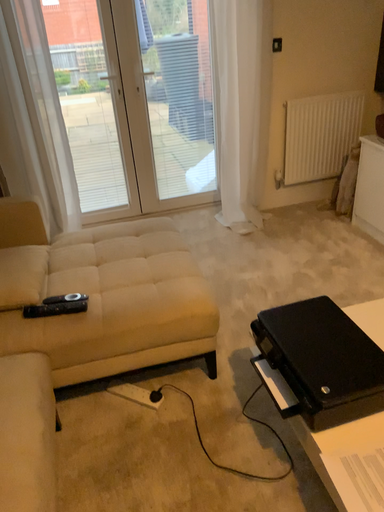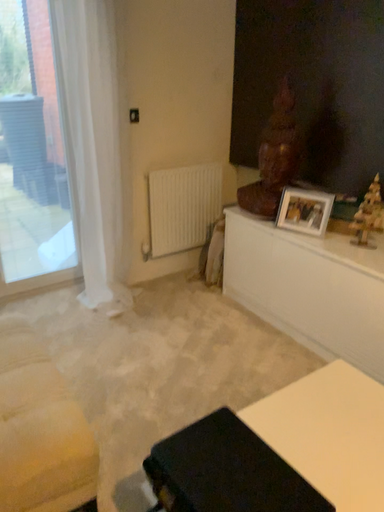
Question: How did the camera likely rotate when shooting the video?

Choices:
 (A) rotated downward
 (B) rotated upward

Answer: (B)